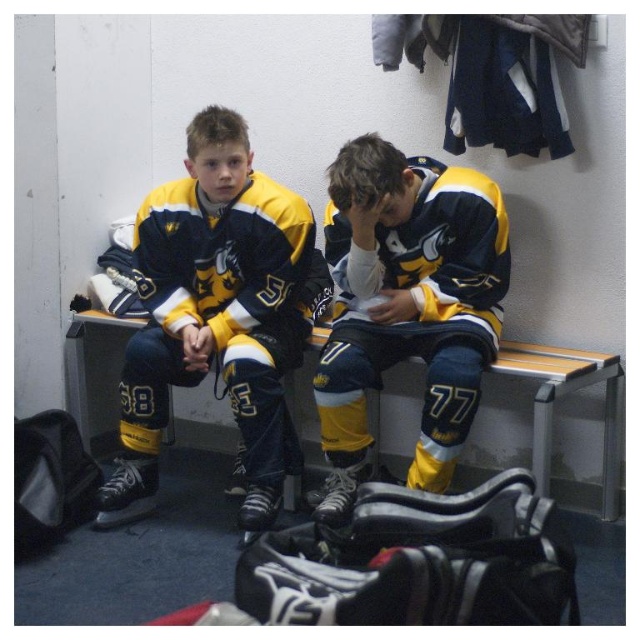
Which is in front, point (252, 276) or point (348, 237)?

Point (348, 237)

Does point (228, 301) come farther from viewer compared to point (333, 420)?

Yes, it is.

This screenshot has width=640, height=640. What are the coordinates of `matte hockey jersey at center` in the screenshot? It's located at coord(218,314).

Is point (184, 288) closer to camera compared to point (620, 392)?

No, it is behind (620, 392).

Can you confirm if matte hockey jersey at center is taller than wooden bench at center?

Indeed, matte hockey jersey at center has a greater height compared to wooden bench at center.

Is point (163, 372) positioned in front of point (378, 403)?

Yes, it is.

Where is `matte hockey jersey at center`? matte hockey jersey at center is located at coordinates (218, 314).

Is the position of matte yellow hockey jersey at center more distant than that of wooden bench at center?

That is False.

Between matte yellow hockey jersey at center and wooden bench at center, which one has more height?

matte yellow hockey jersey at center is taller.

Is point (416, 332) positioned after point (93, 340)?

No, (416, 332) is closer to viewer.

You are a GUI agent. You are given a task and a screenshot of the screen. Output one action in this format:
    pyautogui.click(x=<x>, y=<y>)
    Task: Click on the matte yellow hockey jersey at center
    The width and height of the screenshot is (640, 640).
    Given the screenshot: What is the action you would take?
    pyautogui.click(x=406, y=305)